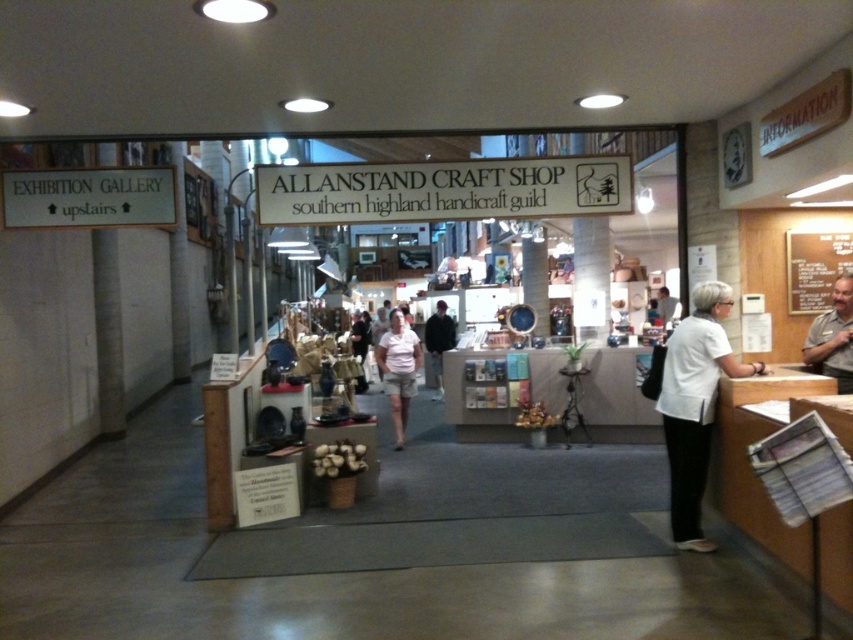
You are standing inside the Allanstand Craft Shop and want to determine the relative positions of two points marked in the scene. Which point is closer to you, point 1 at coordinates (666, 451) or point 2 at coordinates (412, 346)?

Point 1 at coordinates (666, 451) is closer to the viewer than point 2 at coordinates (412, 346).

You are a customer in the craft shop and want to buy a white fabric shirt. The shop assistant tells you that the shirt is located at point (695,404). Can you find the white fabric shirt at center?

The white fabric shirt at center is located at point (695,404), so yes, you can find it there.